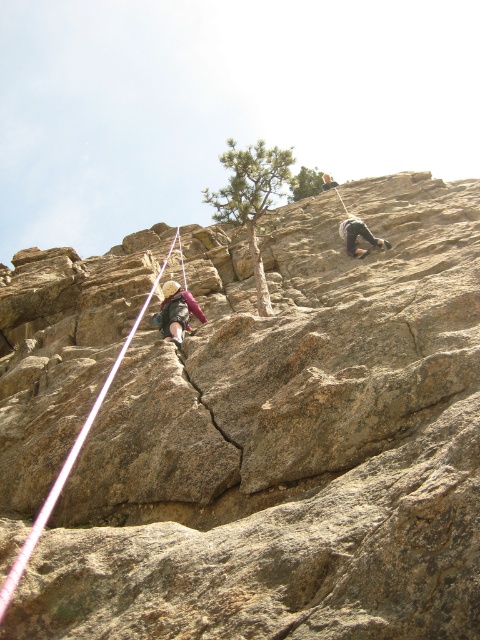
Question: Is matte gray climbing harness at center smaller than dark gray rock climber at right?

Choices:
 (A) yes
 (B) no

Answer: (B)

Question: Which object is positioned farthest from the matte gray climbing harness at center?

Choices:
 (A) dark gray rock climber at right
 (B) white nylon rope at left

Answer: (A)

Question: Considering the real-world distances, which object is closest to the matte gray climbing harness at center?

Choices:
 (A) dark gray rock climber at right
 (B) gray rough rock at center
 (C) white nylon rope at left

Answer: (C)

Question: In this image, where is matte gray climbing harness at center located relative to dark gray rock climber at right?

Choices:
 (A) left
 (B) right

Answer: (A)

Question: Does gray rough rock at center appear under matte gray climbing harness at center?

Choices:
 (A) yes
 (B) no

Answer: (B)

Question: Which point is farther to the camera?

Choices:
 (A) light brown leather helmet at upper center
 (B) matte gray climbing harness at center
 (C) dark gray rock climber at right
 (D) gray rough rock at center

Answer: (A)